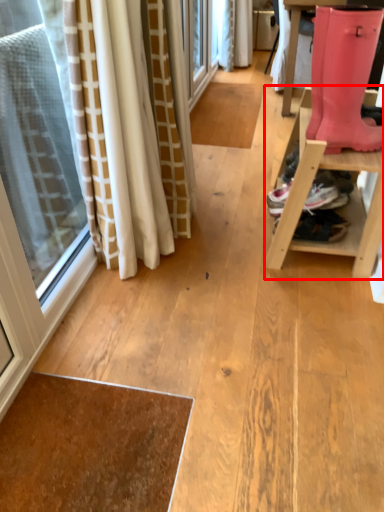
Question: Where is furniture (annotated by the red box) located in relation to footwear in the image?

Choices:
 (A) left
 (B) right

Answer: (B)